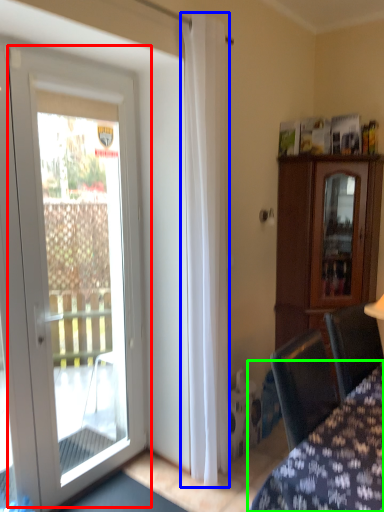
Question: Considering the real-world distances, which object is closest to door (highlighted by a red box)? curtain (highlighted by a blue box) or furniture (highlighted by a green box).

Choices:
 (A) curtain
 (B) furniture

Answer: (A)